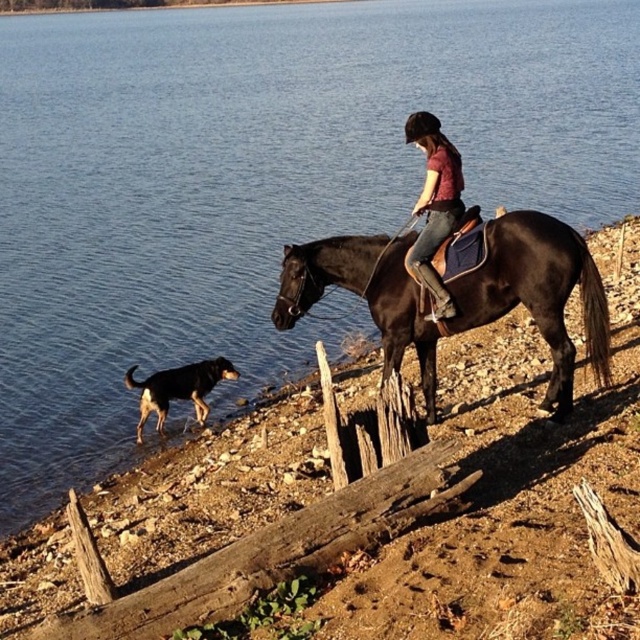
Question: Does shiny dark brown horse at upper center appear under black and tan fur dog at lower left?

Choices:
 (A) no
 (B) yes

Answer: (A)

Question: Which point is farther to the camera?

Choices:
 (A) (438, 173)
 (B) (392, 262)
 (C) (195, 385)

Answer: (C)

Question: From the image, what is the correct spatial relationship of denim jeans at center in relation to black and tan fur dog at lower left?

Choices:
 (A) left
 (B) right

Answer: (B)

Question: Which point appears closest to the camera in this image?

Choices:
 (A) (522, 228)
 (B) (173, 372)
 (C) (420, 193)

Answer: (A)

Question: Which of the following is the closest to the observer?

Choices:
 (A) (182, 369)
 (B) (458, 209)

Answer: (B)

Question: Observing the image, what is the correct spatial positioning of denim jeans at center in reference to black and tan fur dog at lower left?

Choices:
 (A) below
 (B) above

Answer: (B)